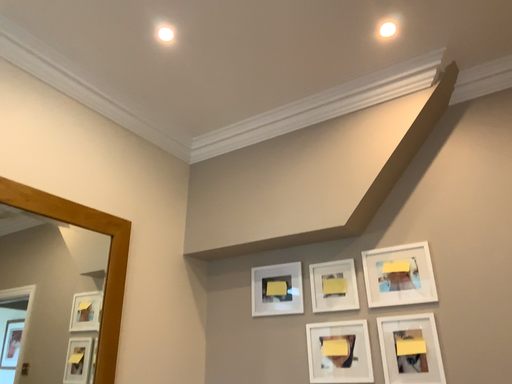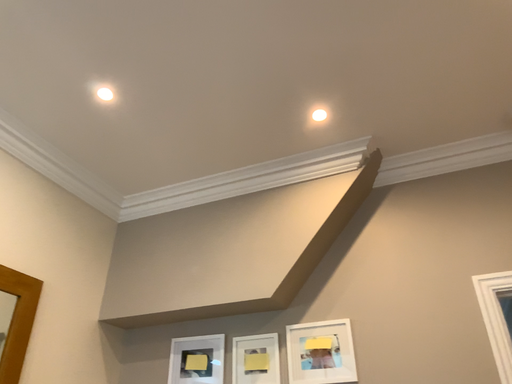
Question: How did the camera likely rotate when shooting the video?

Choices:
 (A) rotated upward
 (B) rotated downward

Answer: (A)